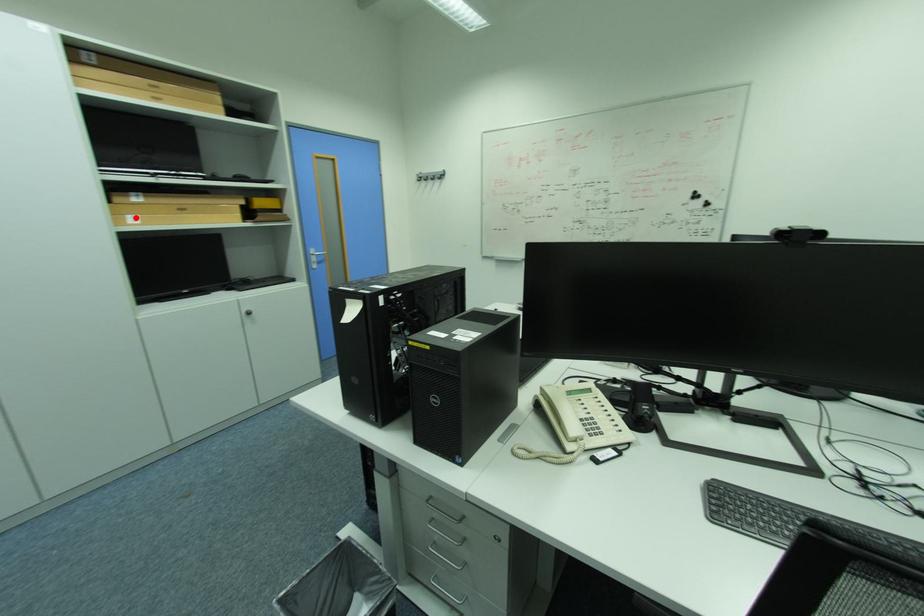
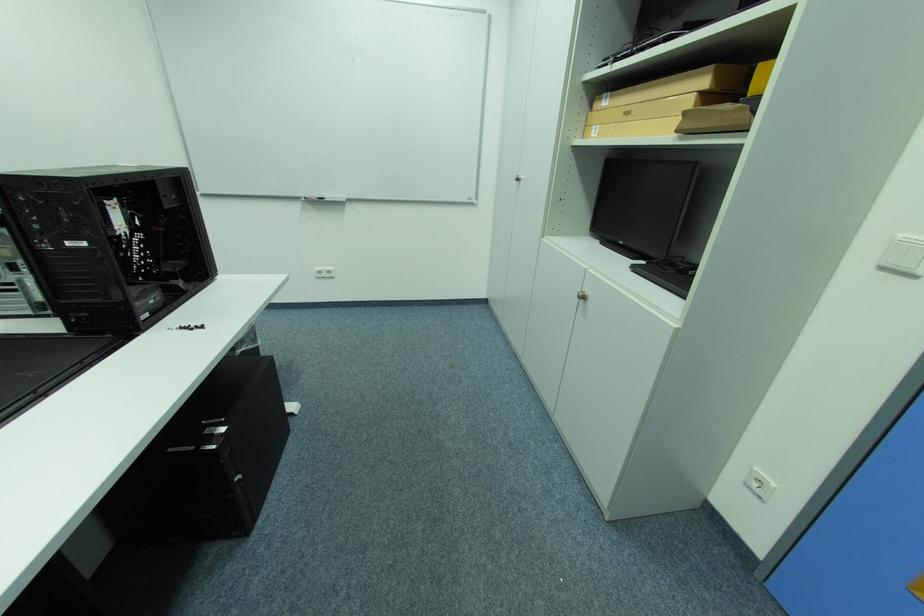
Where in the second image is the point corresponding to the highlighted location from the first image?

(602, 128)